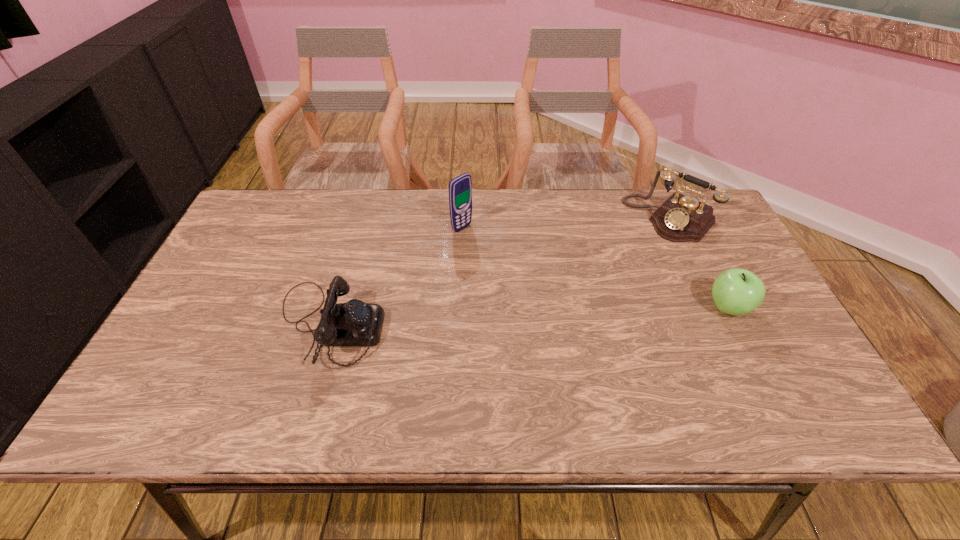
Find the location of a particular element. The height and width of the screenshot is (540, 960). free point between the cellular telephone and the shorter telephone is located at coordinates (396, 276).

What are the coordinates of `vacant region between the shorter telephone and the cellular telephone` in the screenshot? It's located at (396, 276).

Where is `unoccupied position between the shorter telephone and the apple`? unoccupied position between the shorter telephone and the apple is located at coordinates (528, 316).

Where is `unoccupied area between the cellular telephone and the shorter telephone`? unoccupied area between the cellular telephone and the shorter telephone is located at coordinates (396, 276).

Where is `free space between the right telephone and the second object from left to right`? This screenshot has height=540, width=960. free space between the right telephone and the second object from left to right is located at coordinates (565, 223).

This screenshot has width=960, height=540. Find the location of `object that is the closest to the apple`. object that is the closest to the apple is located at coordinates (680, 218).

The image size is (960, 540). I want to click on object that stands as the third closest to the shorter telephone, so click(x=736, y=291).

The image size is (960, 540). What are the coordinates of `vacant point that satisfies the following two spatial constraints: 1. on the front side of the right telephone; 2. on the right side of the apple` in the screenshot? It's located at tap(712, 308).

Image resolution: width=960 pixels, height=540 pixels. I want to click on free space in the image that satisfies the following two spatial constraints: 1. on the front side of the cellular telephone; 2. on the left side of the apple, so click(458, 308).